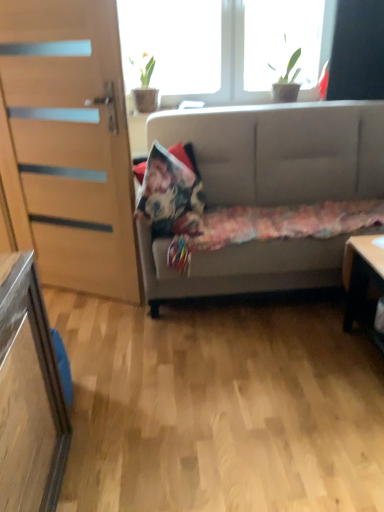
Question: Is floral fabric pillow at center in front of or behind transparent glass window at upper center, arranged as the 1th window when viewed from the left, in the image?

Choices:
 (A) behind
 (B) front

Answer: (B)

Question: Considering the positions of point pyautogui.click(x=150, y=192) and point pyautogui.click(x=215, y=38), is point pyautogui.click(x=150, y=192) closer or farther from the camera than point pyautogui.click(x=215, y=38)?

Choices:
 (A) closer
 (B) farther

Answer: (A)

Question: Which object is positioned closest to the green leafy plant at upper center?

Choices:
 (A) wooden door at left
 (B) light brown wood desk at lower right
 (C) fluffy multicolored blanket at center
 (D) floral fabric pillow at center
 (E) green leafy plant at upper right, which is the 1th window from right to left

Answer: (D)

Question: Estimate the real-world distances between objects in this image. Which object is farther from the wooden door at left?

Choices:
 (A) light brown wood desk at lower right
 (B) transparent glass window at upper center, arranged as the 1th window when viewed from the left
 (C) light gray fabric couch at center
 (D) green leafy plant at upper right, which is the 1th window from right to left
 (E) floral fabric pillow at center

Answer: (D)